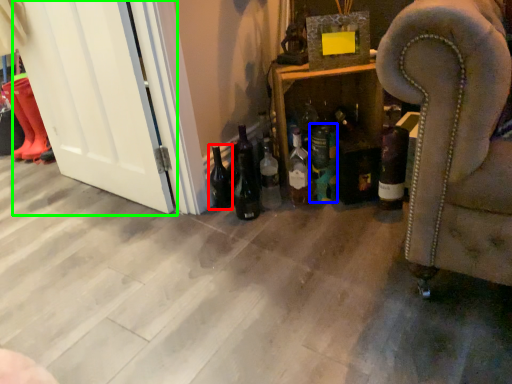
Question: Which object is positioned closest to beer bottle (highlighted by a red box)? Select from bottle (highlighted by a blue box) and screen door (highlighted by a green box).

Choices:
 (A) bottle
 (B) screen door

Answer: (A)